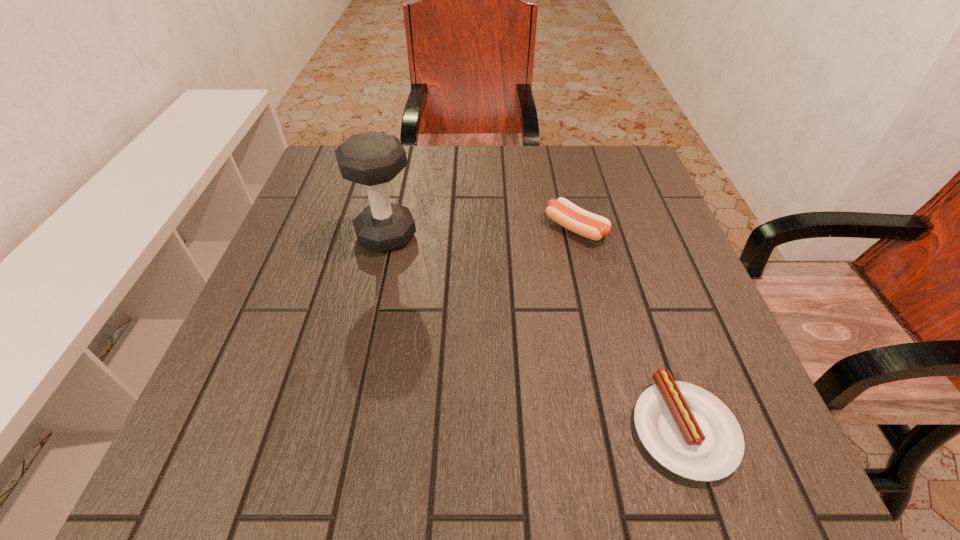
Where is `vacant point located between the nearer sausage and the tallest object`? vacant point located between the nearer sausage and the tallest object is located at coordinates (535, 332).

You are a GUI agent. You are given a task and a screenshot of the screen. Output one action in this format:
    pyautogui.click(x=<x>, y=<y>)
    Task: Click on the free space between the farther sausage and the dumbbell
    This screenshot has height=540, width=960.
    Given the screenshot: What is the action you would take?
    pyautogui.click(x=481, y=232)

I want to click on vacant region between the farther sausage and the dumbbell, so click(x=481, y=232).

Find the location of a particular element. This screenshot has height=540, width=960. free space between the nearer sausage and the farther sausage is located at coordinates (630, 328).

Locate an element on the screen. This screenshot has height=540, width=960. free point between the nearer sausage and the taller sausage is located at coordinates (630, 328).

Identify the location of blank region between the leftmost object and the second shortest object. (481, 232).

At what (x,y) coordinates should I click in order to perform the action: click on free space between the taller sausage and the dumbbell. Please return your answer as a coordinate pair (x, y). The width and height of the screenshot is (960, 540). Looking at the image, I should click on (481, 232).

Where is `free area in between the nearer sausage and the second tallest object`? The height and width of the screenshot is (540, 960). free area in between the nearer sausage and the second tallest object is located at coordinates (630, 328).

Find the location of a particular element. The width and height of the screenshot is (960, 540). object that is the second closest to the taller sausage is located at coordinates (688, 430).

You are a GUI agent. You are given a task and a screenshot of the screen. Output one action in this format:
    pyautogui.click(x=<x>, y=<y>)
    Task: Click on the object that stands as the second closest to the taller sausage
    The image size is (960, 540).
    Given the screenshot: What is the action you would take?
    pyautogui.click(x=688, y=430)